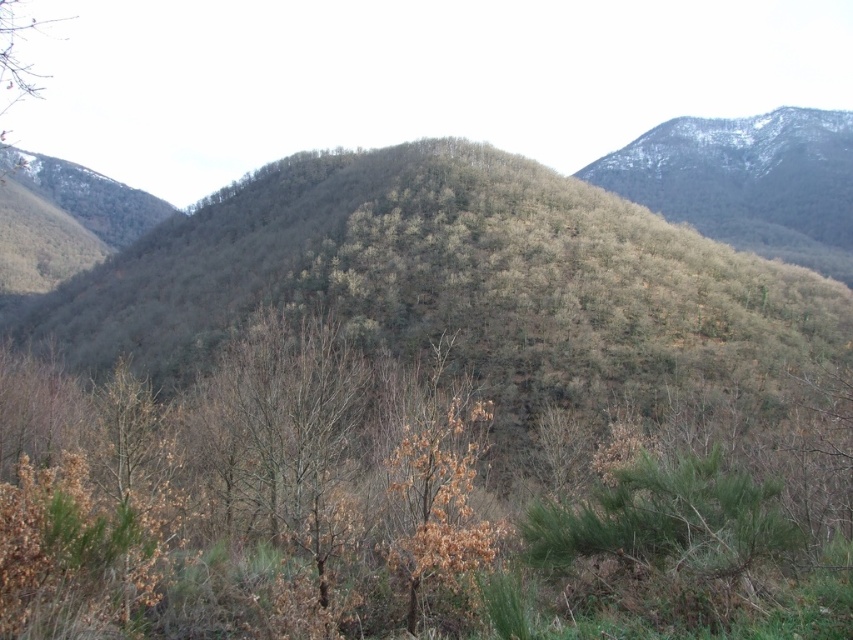
Question: Can you confirm if brown leafy tree at center is bigger than brown leafless tree at upper left?

Choices:
 (A) yes
 (B) no

Answer: (B)

Question: Is the position of brown leafy tree at center less distant than that of brown leafless tree at upper left?

Choices:
 (A) no
 (B) yes

Answer: (B)

Question: Is brown leafy tree at center closer to the viewer compared to brown leafless tree at upper left?

Choices:
 (A) no
 (B) yes

Answer: (B)

Question: Which point appears farthest from the camera in this image?

Choices:
 (A) (280, 342)
 (B) (15, 36)

Answer: (B)

Question: Among these objects, which one is nearest to the camera?

Choices:
 (A) brown leafy tree at center
 (B) brown leafless tree at upper left

Answer: (A)

Question: Which point is farther to the camera?

Choices:
 (A) (256, 365)
 (B) (6, 102)

Answer: (B)